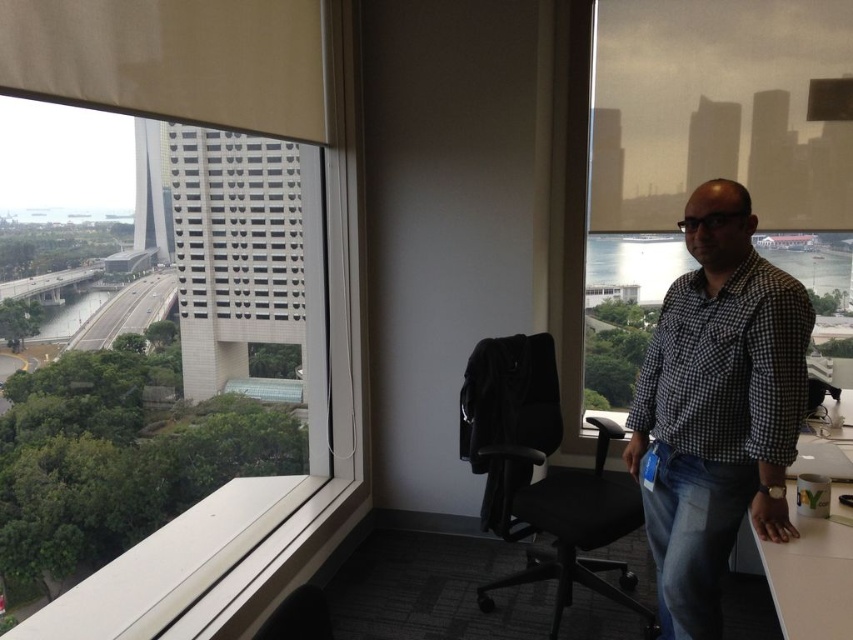
Question: Is transparent glass window at upper right above white matte table at lower right?

Choices:
 (A) yes
 (B) no

Answer: (A)

Question: From the image, what is the correct spatial relationship of transparent glass window at upper left in relation to checkered fabric shirt at right?

Choices:
 (A) right
 (B) left

Answer: (B)

Question: Among these objects, which one is nearest to the camera?

Choices:
 (A) white matte table at lower right
 (B) black fabric swivel chair at center
 (C) checkered fabric shirt at right
 (D) transparent glass window at upper right

Answer: (A)

Question: Is transparent glass window at upper right bigger than white matte table at lower right?

Choices:
 (A) yes
 (B) no

Answer: (A)

Question: Estimate the real-world distances between objects in this image. Which object is farther from the transparent glass window at upper right?

Choices:
 (A) checkered fabric shirt at right
 (B) white matte table at lower right

Answer: (A)

Question: Estimate the real-world distances between objects in this image. Which object is closer to the checkered fabric shirt at right?

Choices:
 (A) black fabric swivel chair at center
 (B) transparent glass window at upper right

Answer: (A)